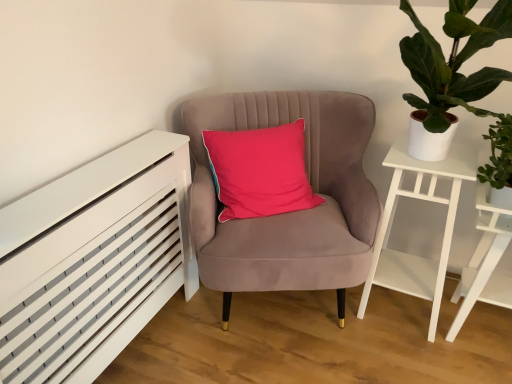
Locate an element on the screen. The width and height of the screenshot is (512, 384). free spot to the left of white wooden side table at right is located at coordinates (413, 355).